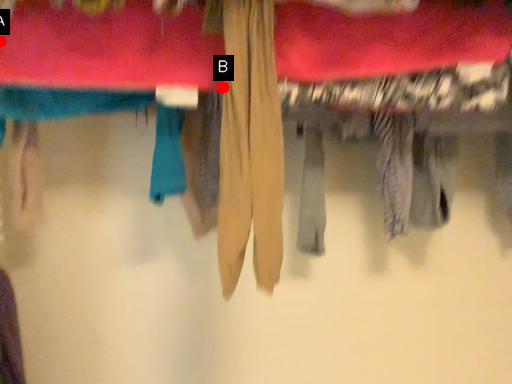
Question: Two points are circled on the image, labeled by A and B beside each circle. Which point is farther to the camera?

Choices:
 (A) A is further
 (B) B is further

Answer: (A)